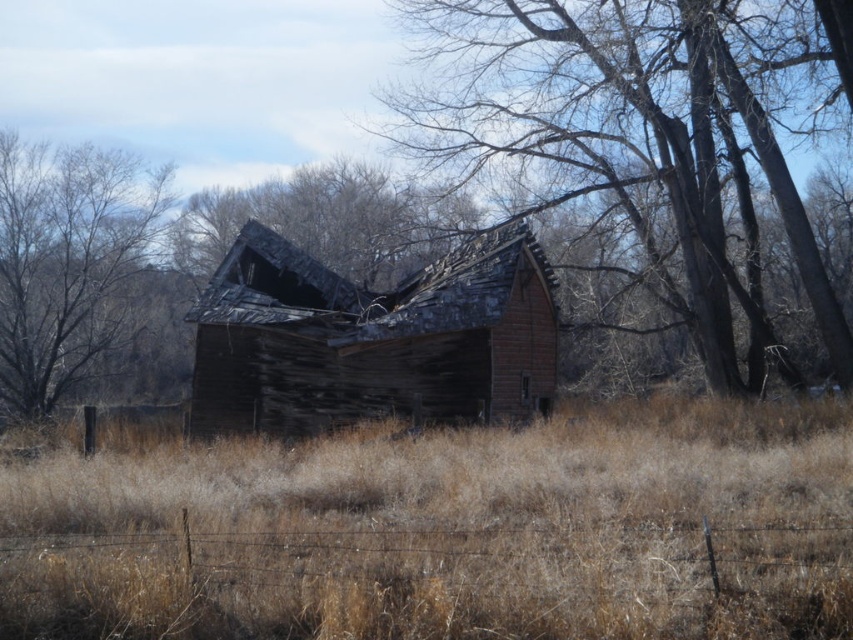
Does weathered wood barn at center appear on the left side of weathered wood roof at center?

No, weathered wood barn at center is not to the left of weathered wood roof at center.

This screenshot has width=853, height=640. Find the location of `weathered wood barn at center`. weathered wood barn at center is located at coordinates (372, 339).

Is point (511, 376) less distant than point (213, 198)?

Yes, it is in front of point (213, 198).

Identify the location of weathered wood barn at center. The height and width of the screenshot is (640, 853). (372, 339).

Is point (154, 616) closer to camera compared to point (451, 333)?

Yes, it is.

From the picture: Is brown dry grass at center closer to camera compared to weathered wood barn at center?

Yes, it is.

This screenshot has height=640, width=853. I want to click on brown dry grass at center, so click(444, 529).

Is point (498, 65) closer to viewer compared to point (286, 195)?

Yes, it is in front of point (286, 195).

Is smooth bark tree at center thinner than weathered wood roof at center?

Incorrect, smooth bark tree at center's width is not less than weathered wood roof at center's.

Is point (593, 179) positioned behind point (294, 220)?

That is False.

Where is `smooth bark tree at center`? The width and height of the screenshot is (853, 640). smooth bark tree at center is located at coordinates (625, 140).